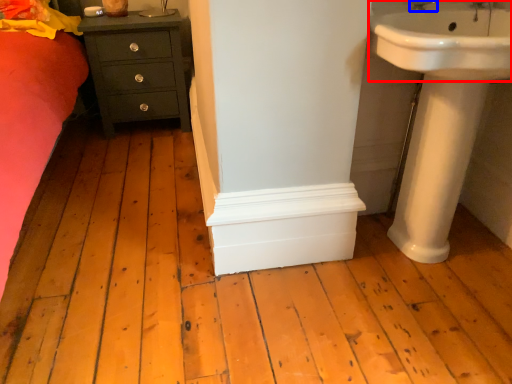
Question: Among these objects, which one is nearest to the camera, sink (highlighted by a red box) or tap (highlighted by a blue box)?

Choices:
 (A) sink
 (B) tap

Answer: (A)